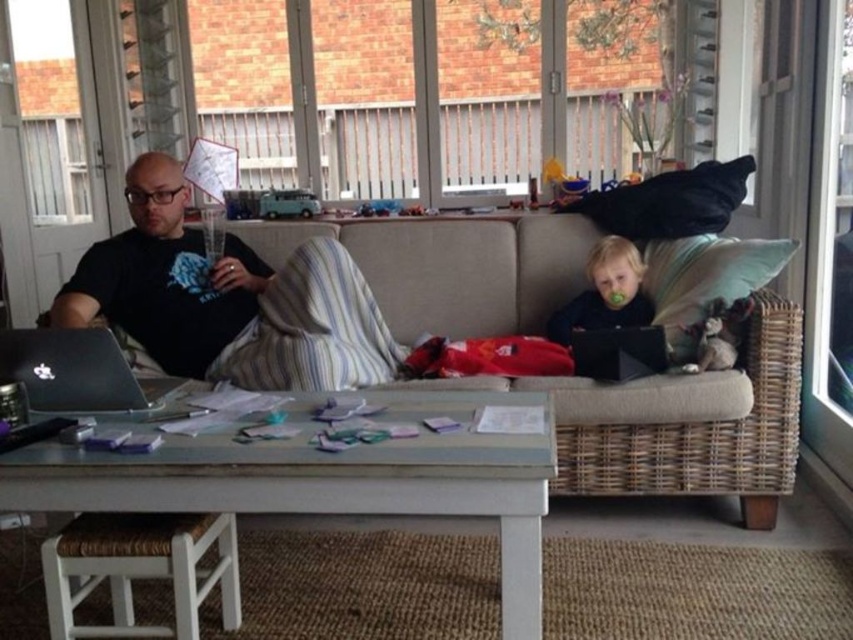
You are a guest in this living room and want to sit down. You see the beige fabric couch at center and the black glossy laptop at left. Which object is closer to the entrance if the entrance is on the left side of the room?

The black glossy laptop at left is closer to the entrance because it is positioned to the left of the beige fabric couch at center, and the entrance is on the left side of the room.

You are standing in the living room and want to sit down on the beige fabric couch at center. Based on the coordinates provided, where exactly should you aim to sit in terms of the room layout?

The beige fabric couch at center is located at coordinates point (689, 426), so you should aim to sit at that specific point in the room layout.

Based on the photo, you are organizing items on the coffee table in the living room and see the black matte laptop at left and the black matte laptop at right. Which one is located more to the left side?

The black matte laptop at left is positioned more to the left side of the black matte laptop at right.